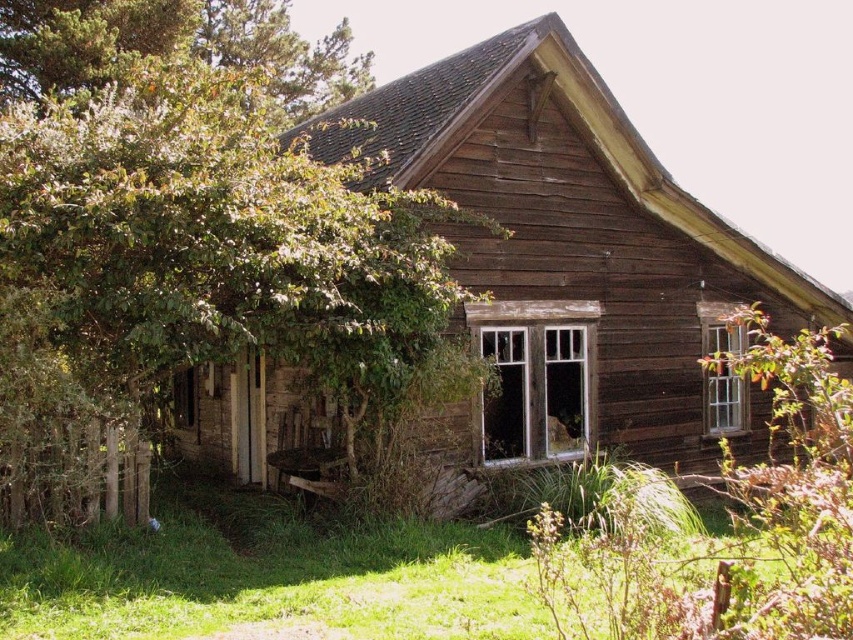
Consider the image. Between green leafy tree at upper left and green grass at lower center, which one has less height?

Standing shorter between the two is green grass at lower center.

Is green leafy tree at upper left to the left of green grass at lower center from the viewer's perspective?

Indeed, green leafy tree at upper left is positioned on the left side of green grass at lower center.

Between point (108, 86) and point (202, 604), which one is positioned behind?

Point (108, 86)

Locate an element on the screen. This screenshot has height=640, width=853. green leafy tree at upper left is located at coordinates (187, 244).

In the scene shown: Measure the distance from weathered wood cabin at center to green grass at lower center.

weathered wood cabin at center and green grass at lower center are 4.94 meters apart.

Can you confirm if weathered wood cabin at center is thinner than green grass at lower center?

No, weathered wood cabin at center is not thinner than green grass at lower center.

Where is `weathered wood cabin at center`? Image resolution: width=853 pixels, height=640 pixels. weathered wood cabin at center is located at coordinates (573, 260).

From the picture: Is green leafy tree at upper left taller than weathered wood cabin at center?

Yes, green leafy tree at upper left is taller than weathered wood cabin at center.

Measure the distance from green leafy tree at upper left to weathered wood cabin at center.

green leafy tree at upper left and weathered wood cabin at center are 2.36 meters apart from each other.

Locate an element on the screen. green leafy tree at upper left is located at coordinates (187, 244).